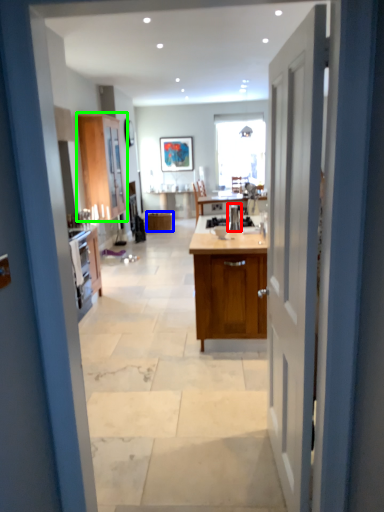
Question: Which object is positioned farthest from appliance (highlighted by a red box)? Select from cabinetry (highlighted by a blue box) and cabinetry (highlighted by a green box).

Choices:
 (A) cabinetry
 (B) cabinetry

Answer: (A)